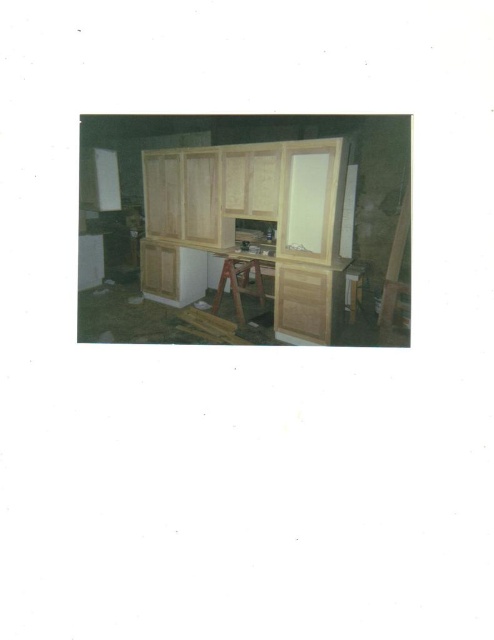
Question: Which of the following is the farthest from the observer?

Choices:
 (A) (242, 285)
 (B) (385, 285)

Answer: (A)

Question: Which object is closer to the camera taking this photo?

Choices:
 (A) wooden stool at center
 (B) wooden ladder at right

Answer: (B)

Question: Does wooden ladder at right have a smaller size compared to wooden stool at center?

Choices:
 (A) yes
 (B) no

Answer: (B)

Question: Does wooden ladder at right have a smaller size compared to wooden stool at center?

Choices:
 (A) no
 (B) yes

Answer: (A)

Question: From the image, what is the correct spatial relationship of wooden ladder at right in relation to wooden stool at center?

Choices:
 (A) left
 (B) right

Answer: (B)